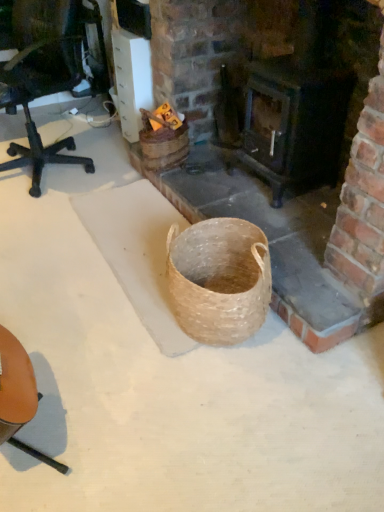
What are the coordinates of `vacant space behind brown leather chair at lower left` in the screenshot? It's located at (68, 331).